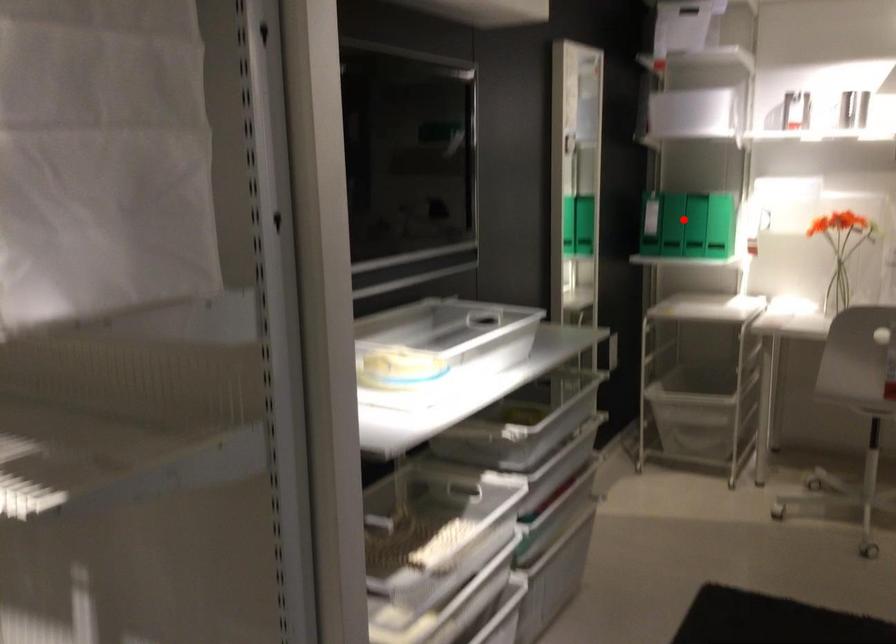
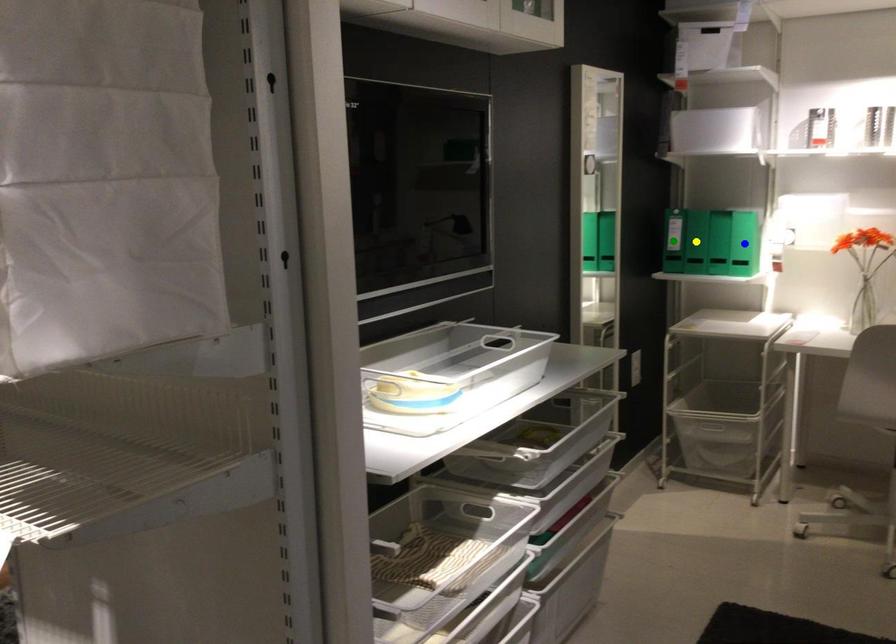
Question: I am providing you with two images of the same scene from different viewpoints. A red point is marked on the first image. You are given multiple points on the second image. Which point in image 2 represents the same 3d spot as the red point in image 1?

Choices:
 (A) yellow point
 (B) blue point
 (C) green point

Answer: (A)